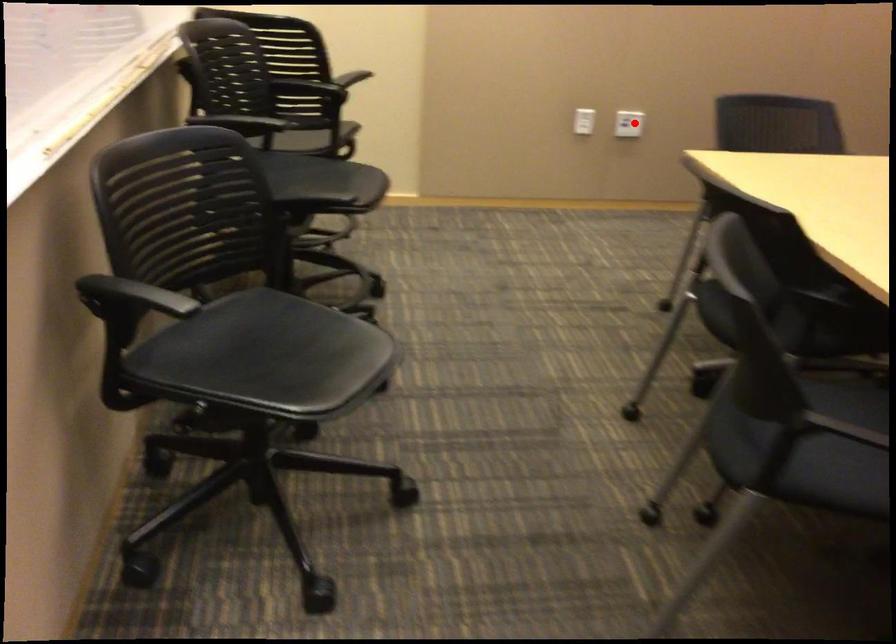
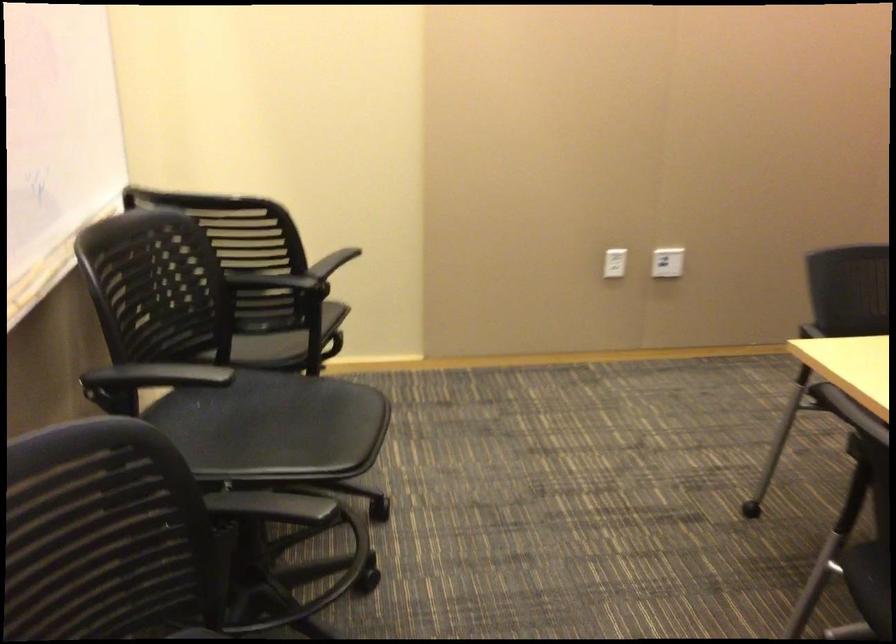
Question: I am providing you with two images of the same scene from different viewpoints. Given a red point in image1, look at the same physical point in image2. Is it:

Choices:
 (A) Closer to the viewpoint
 (B) Farther from the viewpoint

Answer: (A)